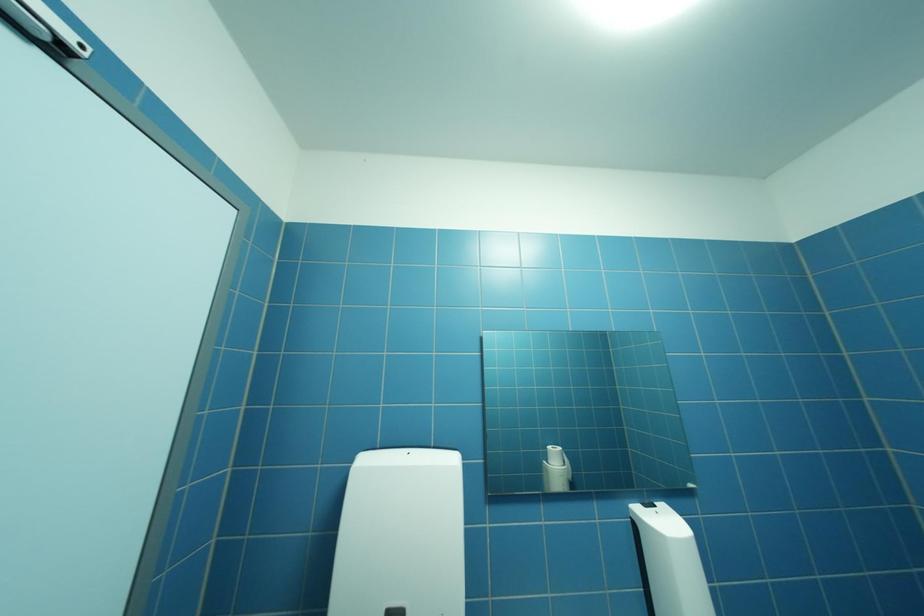
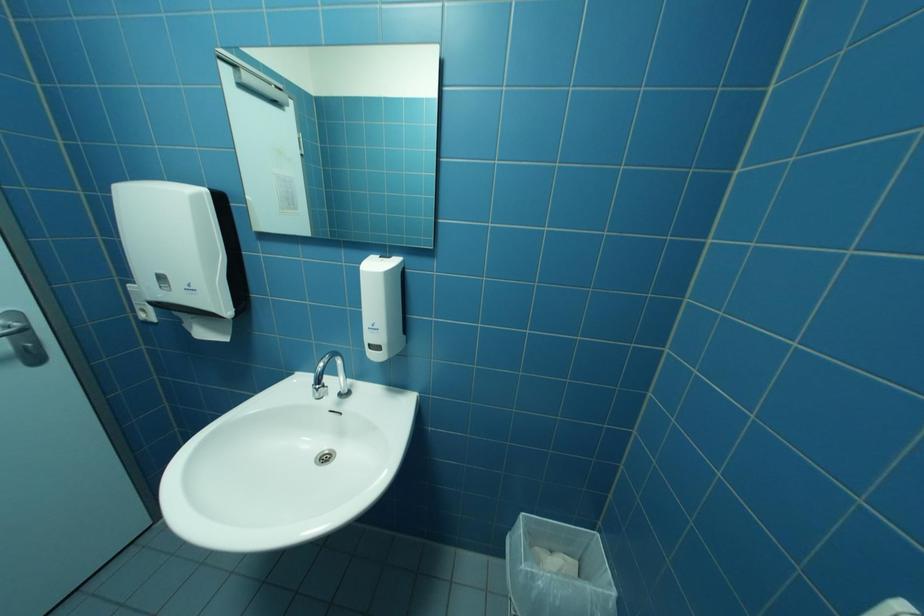
Question: Based on the continuous images, in which direction is the camera rotating? Reply with the corresponding letter.

Choices:
 (A) Left
 (B) Right
 (C) Up
 (D) Down

Answer: (D)